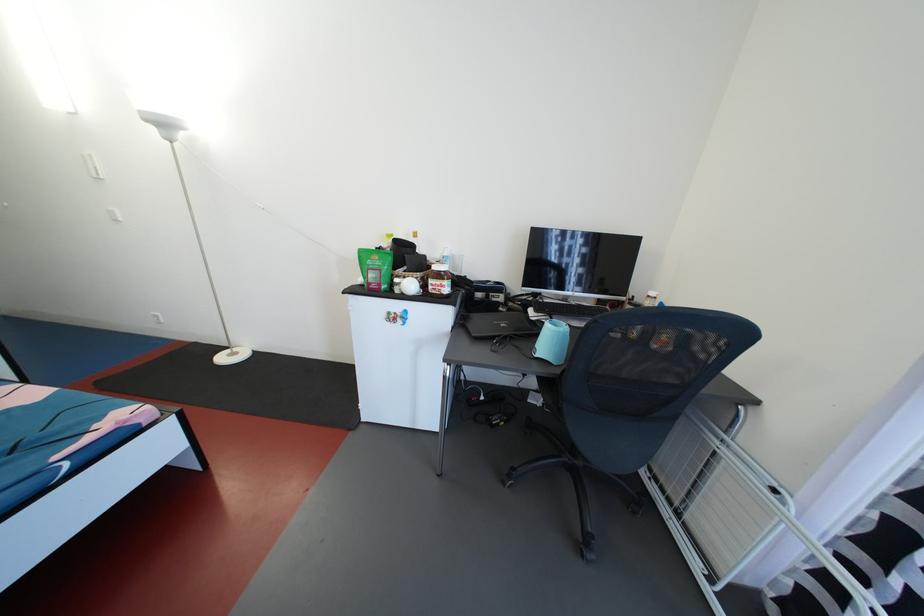
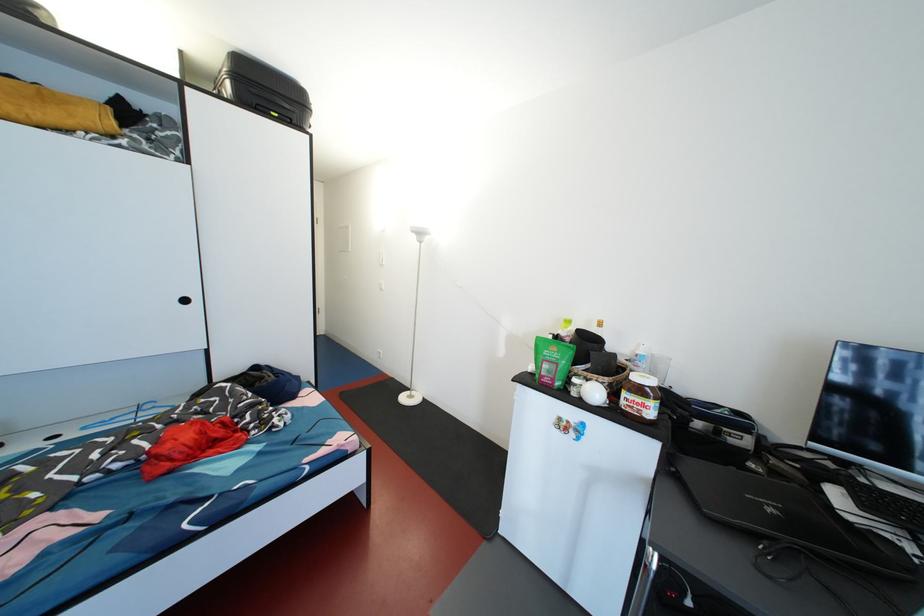
Find the pixel in the second image that matches point 442,272 in the first image.

(641, 383)